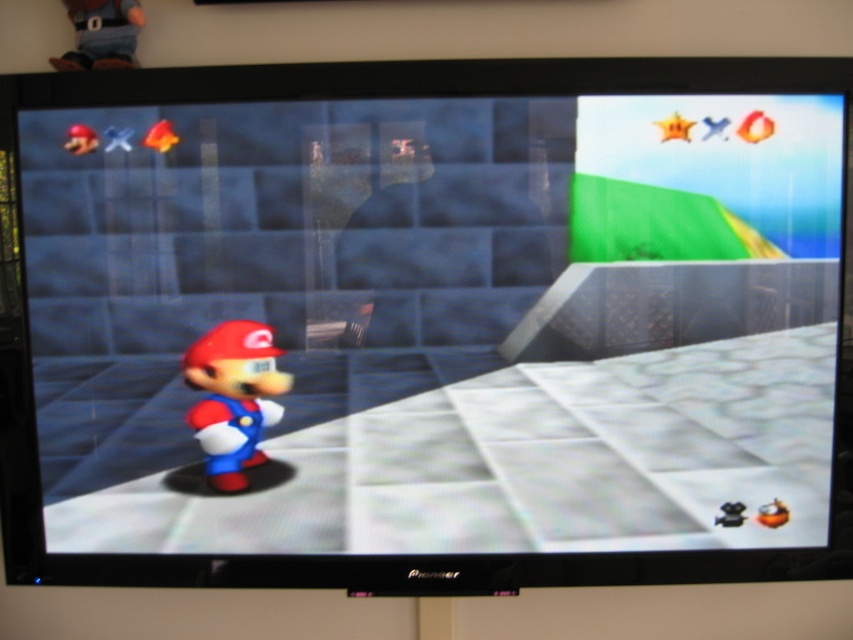
Who is positioned more to the left, smooth matte mario at center or matte plastic mario at center?

matte plastic mario at center is more to the left.

Is smooth matte mario at center closer to the viewer compared to matte plastic mario at center?

Yes, smooth matte mario at center is closer to the viewer.

Consider the image. Who is more distant from viewer, [83,358] or [236,362]?

Positioned behind is point [236,362].

I want to click on smooth matte mario at center, so (440, 321).

Is matte plastic mario at center taller than shiny red star at upper left?

Correct, matte plastic mario at center is much taller as shiny red star at upper left.

Who is shorter, matte plastic mario at center or shiny red star at upper left?

shiny red star at upper left is shorter.

Is point (227, 419) farther from viewer compared to point (74, 125)?

That is True.

Where is `matte plastic mario at center`? The image size is (853, 640). matte plastic mario at center is located at coordinates (233, 397).

In the scene shown: Can you confirm if smooth matte mario at center is smaller than shiny red star at upper left?

No, smooth matte mario at center is not smaller than shiny red star at upper left.

Measure the distance between point (39, 305) and camera.

The distance of point (39, 305) from camera is 1.18 meters.

Does point (573, 192) come farther from viewer compared to point (94, 147)?

No, (573, 192) is closer to viewer.

The width and height of the screenshot is (853, 640). Find the location of `smooth matte mario at center`. smooth matte mario at center is located at coordinates (440, 321).